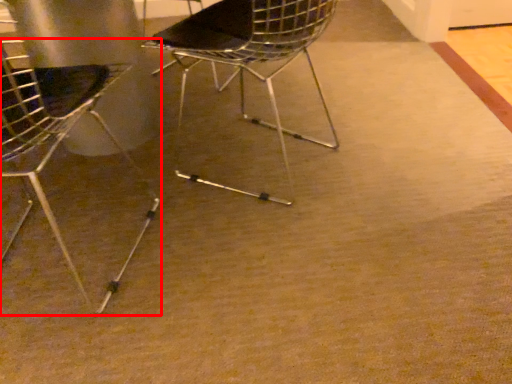
Question: From the image's perspective, what is the correct spatial relationship of chair (annotated by the red box) in relation to chair?

Choices:
 (A) above
 (B) below

Answer: (B)